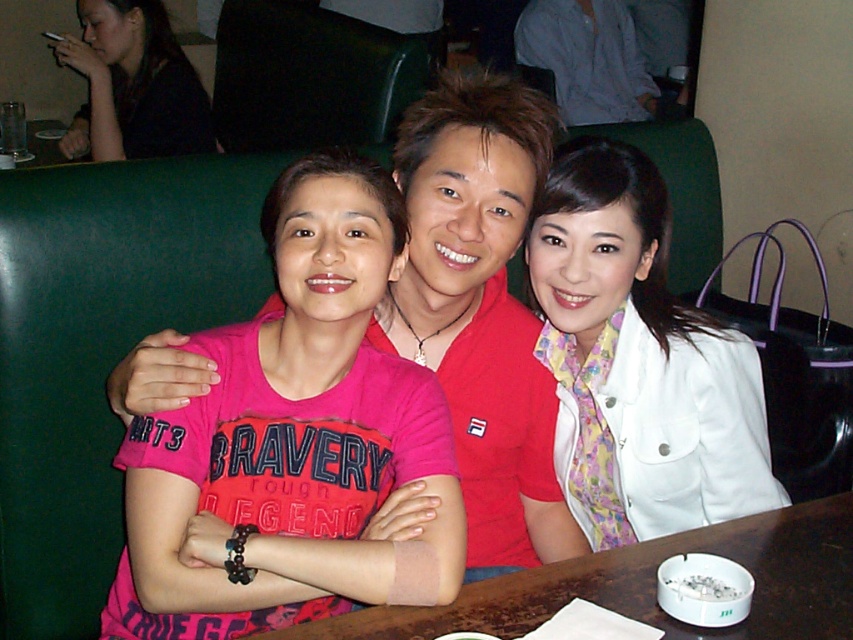
Does white satin jacket at upper right appear over brown wooden table at center?

Correct, white satin jacket at upper right is located above brown wooden table at center.

Looking at this image, who is positioned more to the left, white satin jacket at upper right or brown wooden table at center?

Positioned to the left is brown wooden table at center.

Is point (698, 472) more distant than point (396, 609)?

Yes, point (698, 472) is behind point (396, 609).

Identify the location of white satin jacket at upper right. Image resolution: width=853 pixels, height=640 pixels. (637, 362).

Is white satin jacket at upper right above matte black hair at upper left?

No.

Does white satin jacket at upper right come behind matte black hair at upper left?

No, it is in front of matte black hair at upper left.

Find the location of `white satin jacket at upper right`. white satin jacket at upper right is located at coordinates (637, 362).

Identify the location of white satin jacket at upper right. The width and height of the screenshot is (853, 640). (637, 362).

Is brown wooden table at center positioned before matte black hair at upper left?

Yes, brown wooden table at center is in front of matte black hair at upper left.

Which is below, brown wooden table at center or matte black hair at upper left?

brown wooden table at center is lower down.

Between point (386, 616) and point (166, 125), which one is positioned behind?

The point (166, 125) is more distant.

The image size is (853, 640). I want to click on brown wooden table at center, so click(x=651, y=586).